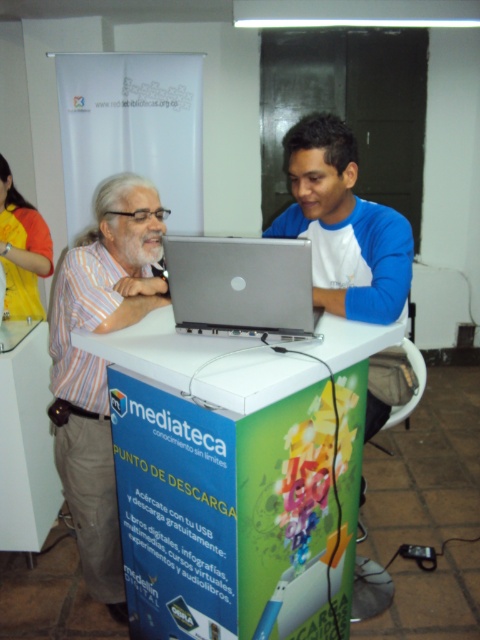
Who is shorter, striped cotton shirt at left or silver metallic laptop at center?

silver metallic laptop at center

Is striped cotton shirt at left to the right of silver metallic laptop at center from the viewer's perspective?

In fact, striped cotton shirt at left is to the left of silver metallic laptop at center.

Between point (108, 470) and point (271, 314), which one is positioned behind?

The point (108, 470) is behind.

Where is `striped cotton shirt at left`? This screenshot has height=640, width=480. striped cotton shirt at left is located at coordinates (100, 364).

Can you confirm if white plastic table at center is positioned above silver metallic laptop at center?

Incorrect, white plastic table at center is not positioned above silver metallic laptop at center.

Does white plastic table at center have a lesser height compared to silver metallic laptop at center?

No, white plastic table at center is not shorter than silver metallic laptop at center.

The height and width of the screenshot is (640, 480). Find the location of `white plastic table at center`. white plastic table at center is located at coordinates (238, 476).

Who is more forward, (256, 538) or (25, 282)?

Point (256, 538) is more forward.

Between white plastic table at center and yellow fabric shirt at left, which one is positioned lower?

Positioned lower is white plastic table at center.

Identify the location of white plastic table at center. This screenshot has height=640, width=480. (238, 476).